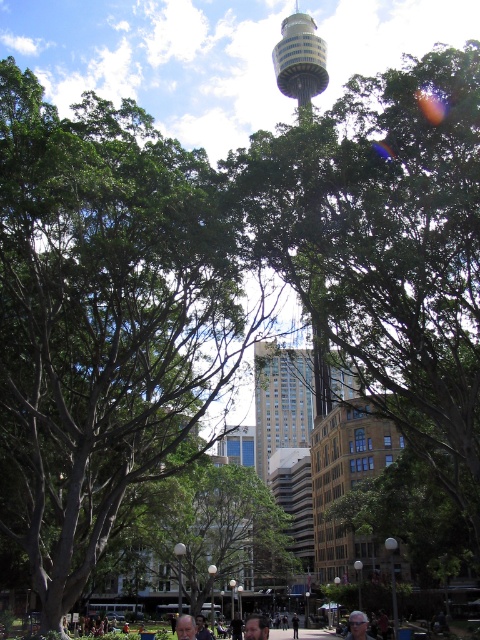
Question: Does brown leather jacket at center appear over matte black hair at center?

Choices:
 (A) yes
 (B) no

Answer: (B)

Question: Considering the relative positions of green leafy tree at center and gray hair at center in the image provided, where is green leafy tree at center located with respect to gray hair at center?

Choices:
 (A) left
 (B) right

Answer: (B)

Question: Which is farther from the gray hair at center?

Choices:
 (A) matte black hair at center
 (B) brown leather jacket at center
 (C) green leafy tree at center

Answer: (C)

Question: Considering the real-world distances, which object is farthest from the gray hair at center?

Choices:
 (A) green leafy tree at center
 (B) matte black hair at center
 (C) brown leather jacket at center

Answer: (A)

Question: Which point is closer to the camera?

Choices:
 (A) (181, 625)
 (B) (396, 314)

Answer: (A)

Question: Observing the image, what is the correct spatial positioning of matte black hair at center in reference to gray hair at center?

Choices:
 (A) right
 (B) left

Answer: (A)